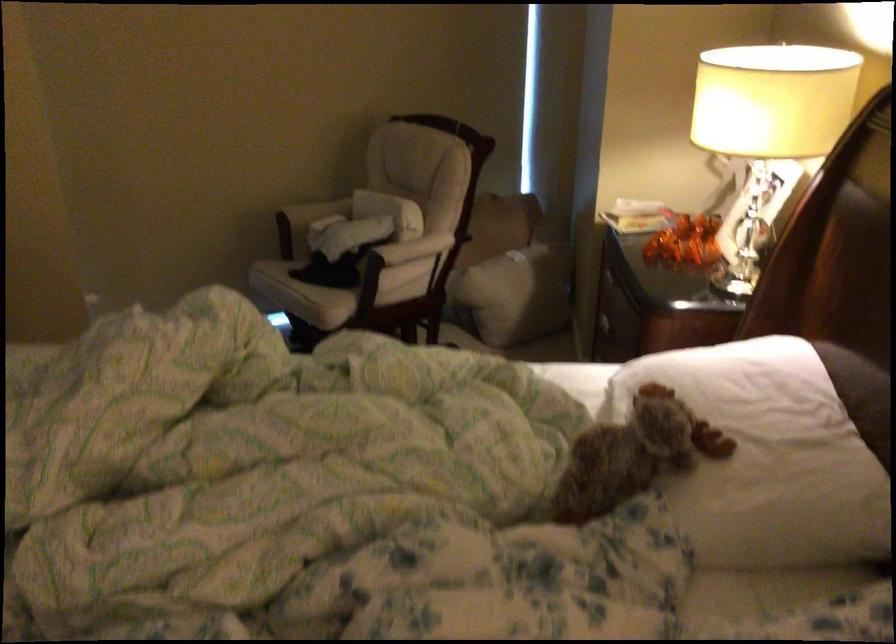
Locate an element on the screen. The height and width of the screenshot is (644, 896). white bed pillow is located at coordinates (767, 458).